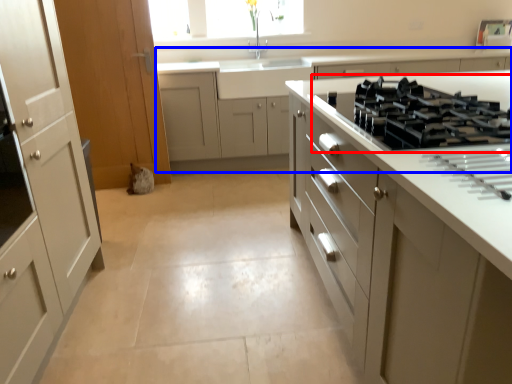
Question: Which point is closer to the camera, gas stove (highlighted by a red box) or cabinetry (highlighted by a blue box)?

Choices:
 (A) gas stove
 (B) cabinetry

Answer: (A)